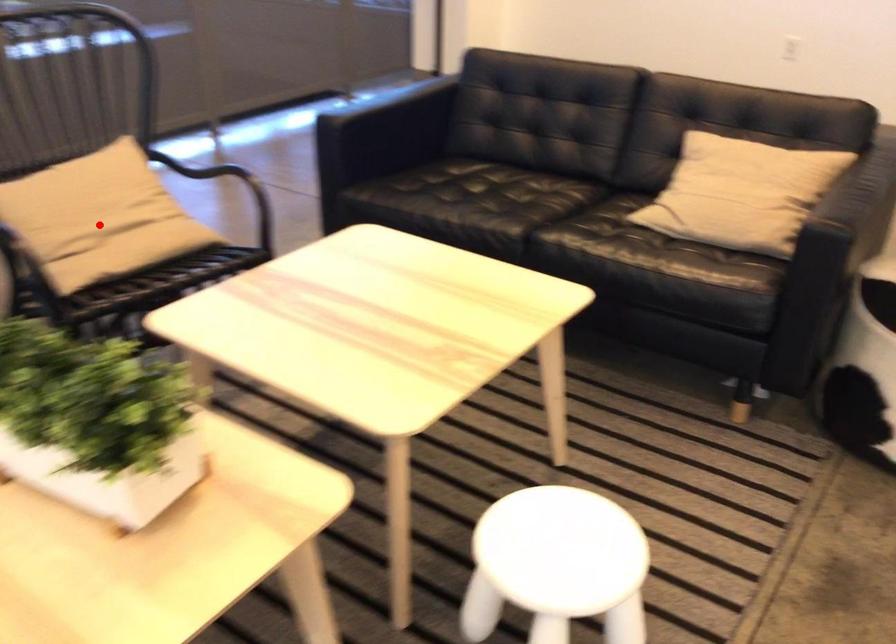
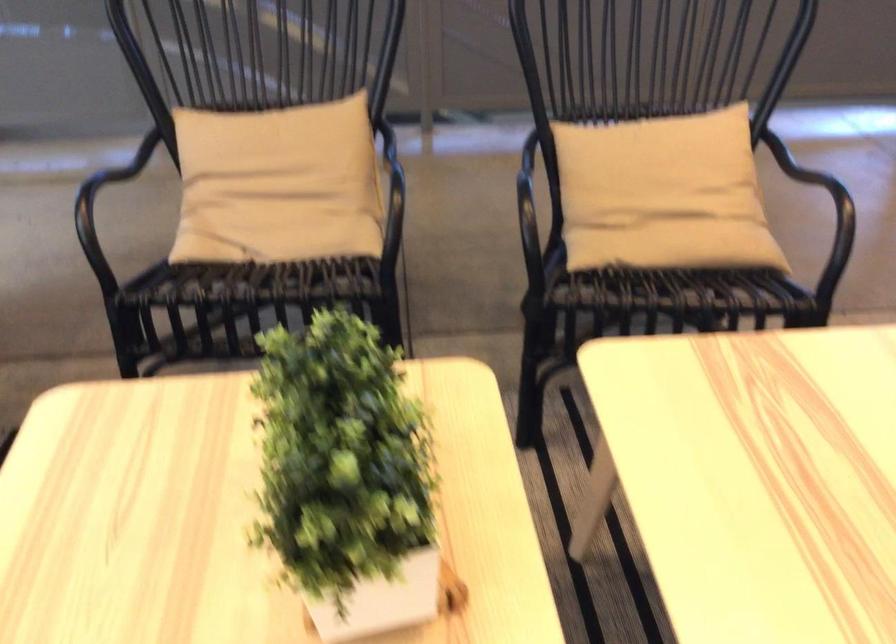
Question: I am providing you with two images of the same scene from different viewpoints. Given a red point in image1, look at the same physical point in image2. Is it:

Choices:
 (A) Closer to the viewpoint
 (B) Farther from the viewpoint

Answer: (A)